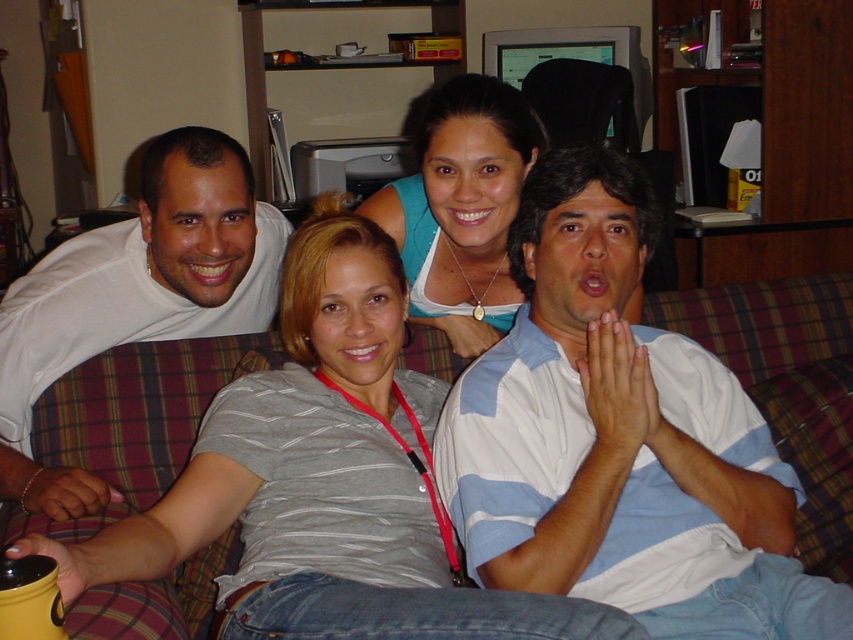
Question: Can you confirm if white striped shirt at center is positioned to the right of matte blue tank top at center?

Choices:
 (A) no
 (B) yes

Answer: (B)

Question: Which object is closer to the camera taking this photo?

Choices:
 (A) white striped shirt at center
 (B) white matte shirt at upper left
 (C) matte blue tank top at center

Answer: (A)

Question: Does white striped shirt at center have a smaller size compared to matte blue tank top at center?

Choices:
 (A) no
 (B) yes

Answer: (A)

Question: Based on their relative distances, which object is nearer to the white striped shirt at center?

Choices:
 (A) matte blue tank top at center
 (B) white matte shirt at upper left

Answer: (A)

Question: Does white matte shirt at upper left have a lesser width compared to matte blue tank top at center?

Choices:
 (A) yes
 (B) no

Answer: (B)

Question: Which point appears closest to the camera in this image?

Choices:
 (A) (741, 458)
 (B) (28, 496)
 (C) (473, 349)

Answer: (A)